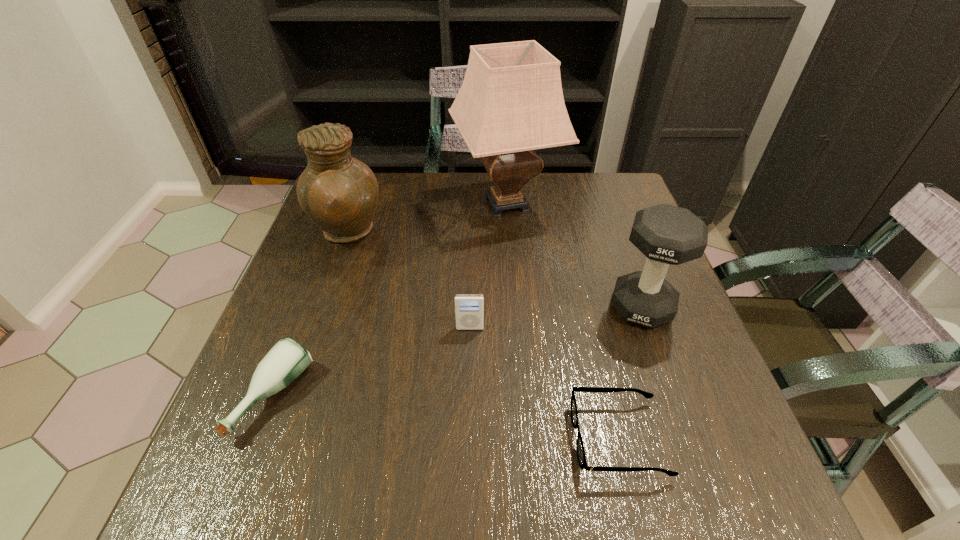
Locate an element on the screen. Image resolution: width=960 pixels, height=540 pixels. vacant space situated on the back of the bottle is located at coordinates (321, 273).

This screenshot has height=540, width=960. Identify the location of vacant space situated on the arms of the spectacles. coord(372,438).

What are the coordinates of `free spot located on the arms of the spectacles` in the screenshot? It's located at point(423,438).

Identify the location of blank space located 0.210m on the arms of the spectacles. The height and width of the screenshot is (540, 960). (453, 438).

Where is `lampshade that is at the far edge`? lampshade that is at the far edge is located at coordinates (511, 102).

The width and height of the screenshot is (960, 540). I want to click on pitcher that is at the far edge, so click(x=339, y=193).

Find the location of `object that is at the near edge`. object that is at the near edge is located at coordinates (581, 456).

I want to click on pitcher that is at the left edge, so click(x=339, y=193).

Where is `bottle that is at the left edge`? The width and height of the screenshot is (960, 540). bottle that is at the left edge is located at coordinates (287, 359).

Locate an element on the screen. The image size is (960, 540). dumbbell located at the right edge is located at coordinates (667, 235).